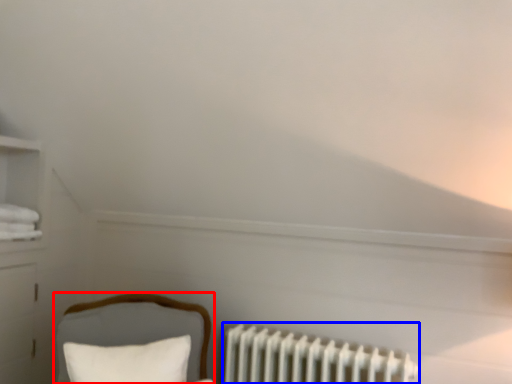
Question: Which of the following is the farthest to the observer, furniture (highlighted by a red box) or radiator (highlighted by a blue box)?

Choices:
 (A) furniture
 (B) radiator

Answer: (B)